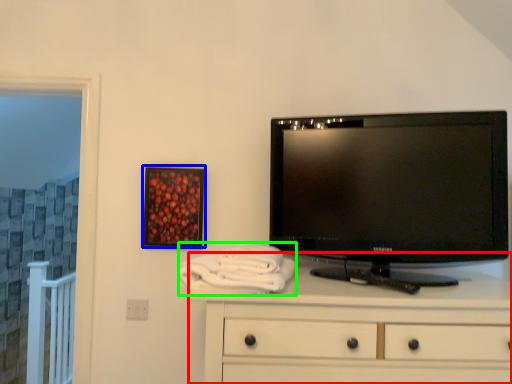
Question: Which object is the closest to the chest of drawers (highlighted by a red box)? Choose among these: picture frame (highlighted by a blue box) or bath towel (highlighted by a green box).

Choices:
 (A) picture frame
 (B) bath towel

Answer: (B)